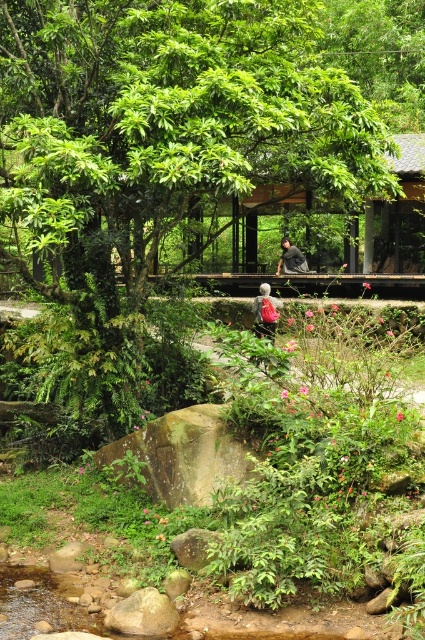
Question: Considering the relative positions of matte gray backpack at center and dark gray fabric jacket at center in the image provided, where is matte gray backpack at center located with respect to dark gray fabric jacket at center?

Choices:
 (A) left
 (B) right

Answer: (A)

Question: Which of the following is the farthest from the observer?

Choices:
 (A) dark gray fabric jacket at center
 (B) green leafy tree at center

Answer: (A)

Question: Does green leafy bush at center appear under matte gray backpack at center?

Choices:
 (A) no
 (B) yes

Answer: (B)

Question: Which point is farther to the camera?

Choices:
 (A) (289, 243)
 (B) (255, 298)
 (C) (223, 403)

Answer: (A)

Question: Which point is farther to the camera?

Choices:
 (A) dark gray fabric jacket at center
 (B) green leafy tree at center
 (C) green leafy bush at center
 (D) matte gray backpack at center

Answer: (A)

Question: Is green leafy bush at center in front of dark gray fabric jacket at center?

Choices:
 (A) no
 (B) yes

Answer: (B)